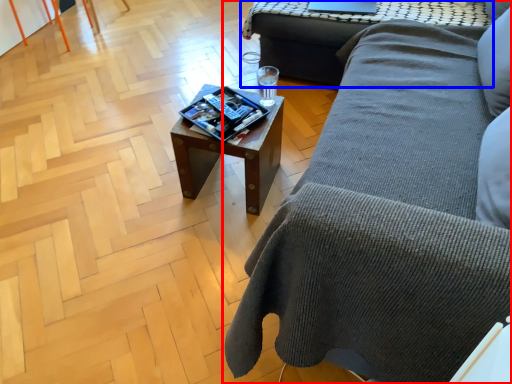
Question: Which of the following is the closest to the observer, studio couch (highlighted by a red box) or table (highlighted by a blue box)?

Choices:
 (A) studio couch
 (B) table

Answer: (A)